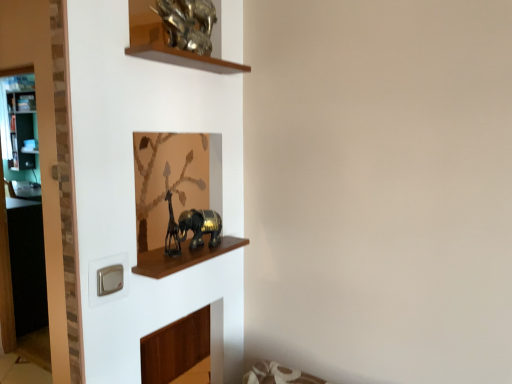
Question: Would you say gold metallic elephant at center, acting as the 1th animal starting from the bottom, is to the left or to the right of transparent glass door at left in the picture?

Choices:
 (A) right
 (B) left

Answer: (A)

Question: Looking at the image, does gold metallic elephant at center, the second animal positioned from the top, seem bigger or smaller compared to transparent glass door at left?

Choices:
 (A) big
 (B) small

Answer: (B)

Question: Which of these objects is positioned closest to the transparent glass door at left?

Choices:
 (A) gold metallic sculpture at upper center, which is the second animal in bottom-to-top order
 (B) shiny brown cabinet at center
 (C) gold metallic elephant at center, acting as the 1th animal starting from the bottom

Answer: (B)

Question: Which of these objects is positioned farthest from the transparent glass door at left?

Choices:
 (A) gold metallic sculpture at upper center, which is the second animal in bottom-to-top order
 (B) gold metallic elephant at center, the second animal positioned from the top
 (C) shiny brown cabinet at center

Answer: (A)